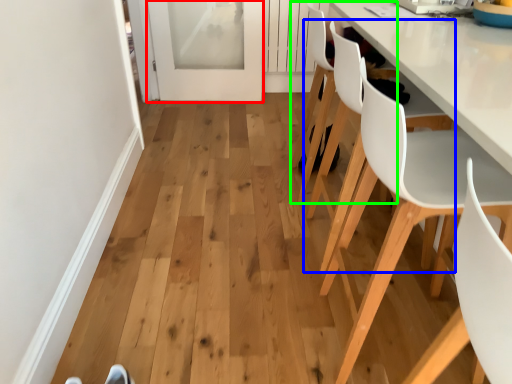
Question: Considering the real-world distances, which object is closest to screen door (highlighted by a red box)? chair (highlighted by a blue box) or chair (highlighted by a green box).

Choices:
 (A) chair
 (B) chair

Answer: (B)